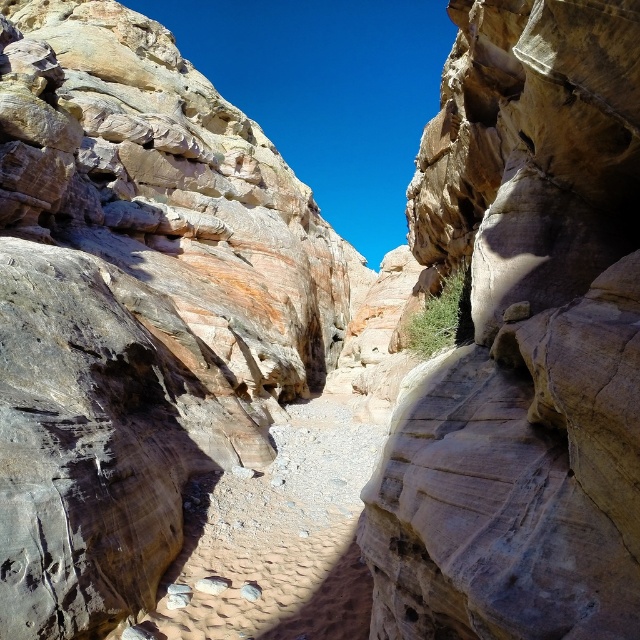
Question: Does rustic sandstone rock face at center have a smaller size compared to smooth sandstone rock face at center?

Choices:
 (A) yes
 (B) no

Answer: (B)

Question: Which object appears farthest from the camera in this image?

Choices:
 (A) smooth sandstone rock face at center
 (B) rustic sandstone rock face at center

Answer: (B)

Question: In this image, where is rustic sandstone rock face at center located relative to smooth sandstone rock face at center?

Choices:
 (A) right
 (B) left

Answer: (B)

Question: Which object is farther from the camera taking this photo?

Choices:
 (A) rustic sandstone rock face at center
 (B) smooth sandstone rock face at center

Answer: (A)

Question: Which object appears farthest from the camera in this image?

Choices:
 (A) rustic sandstone rock face at center
 (B) smooth sandstone rock face at center

Answer: (A)

Question: Is rustic sandstone rock face at center closer to the viewer compared to smooth sandstone rock face at center?

Choices:
 (A) no
 (B) yes

Answer: (A)